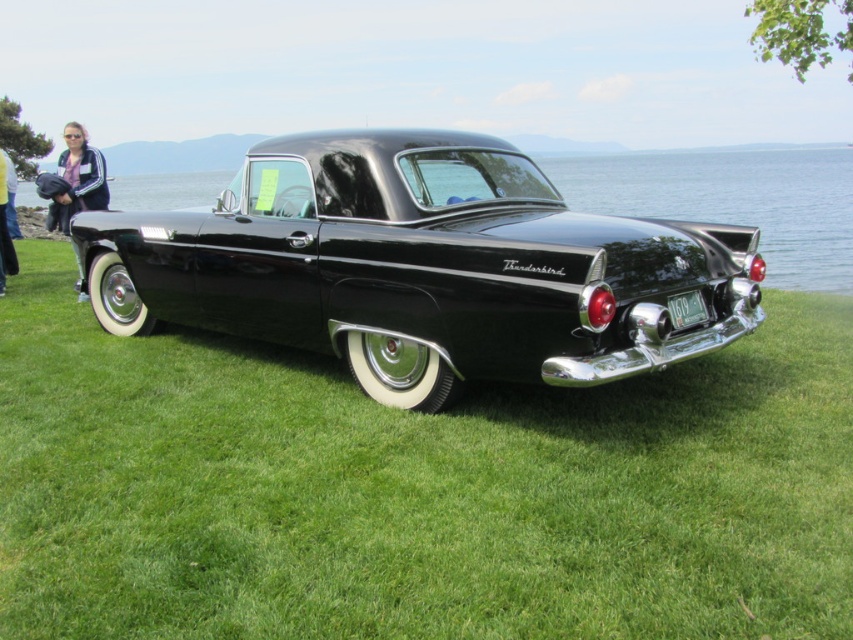
Is glossy black thunderbird at center further to camera compared to denim pants at left?

No, glossy black thunderbird at center is in front of denim pants at left.

Does glossy black thunderbird at center have a lesser height compared to denim pants at left?

No, glossy black thunderbird at center is not shorter than denim pants at left.

Identify the location of glossy black thunderbird at center. (424, 268).

Can you confirm if matte black jacket at left is positioned to the right of denim pants at left?

Yes, matte black jacket at left is to the right of denim pants at left.

The height and width of the screenshot is (640, 853). Find the location of `matte black jacket at left`. matte black jacket at left is located at coordinates (79, 188).

Does glossy black thunderbird at center appear on the right side of matte black jacket at left?

Yes, glossy black thunderbird at center is to the right of matte black jacket at left.

Does point (561, 259) lie behind point (80, 134)?

No.

Where is `glossy black thunderbird at center`? glossy black thunderbird at center is located at coordinates (424, 268).

Where is `glossy black thunderbird at center`? This screenshot has width=853, height=640. glossy black thunderbird at center is located at coordinates (424, 268).